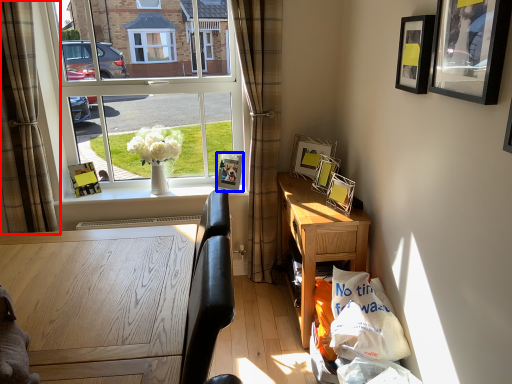
Question: Which object is closer to the camera taking this photo, curtain (highlighted by a red box) or picture frame (highlighted by a blue box)?

Choices:
 (A) curtain
 (B) picture frame

Answer: (A)